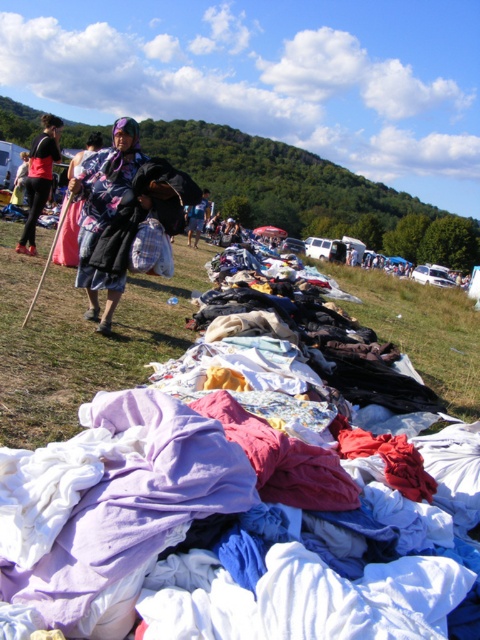
Question: Can you confirm if blue denim jeans at center is wider than light blue fabric at center?

Choices:
 (A) yes
 (B) no

Answer: (A)

Question: Among these points, which one is farthest from the camera?

Choices:
 (A) (362, 301)
 (B) (83, 211)
 (C) (37, 179)
 (D) (94, 362)

Answer: (A)

Question: Considering the relative positions of green grass at left and green grass at center in the image provided, where is green grass at left located with respect to green grass at center?

Choices:
 (A) left
 (B) right

Answer: (A)

Question: Among these points, which one is nearest to the camera?

Choices:
 (A) (435, 388)
 (B) (106, 163)

Answer: (B)

Question: Can you confirm if wrinkled fabric at center is positioned to the right of floral fabric dress at center?

Choices:
 (A) no
 (B) yes

Answer: (B)

Question: Among these points, which one is farthest from the camera?

Choices:
 (A) (205, 212)
 (B) (130, 289)

Answer: (A)